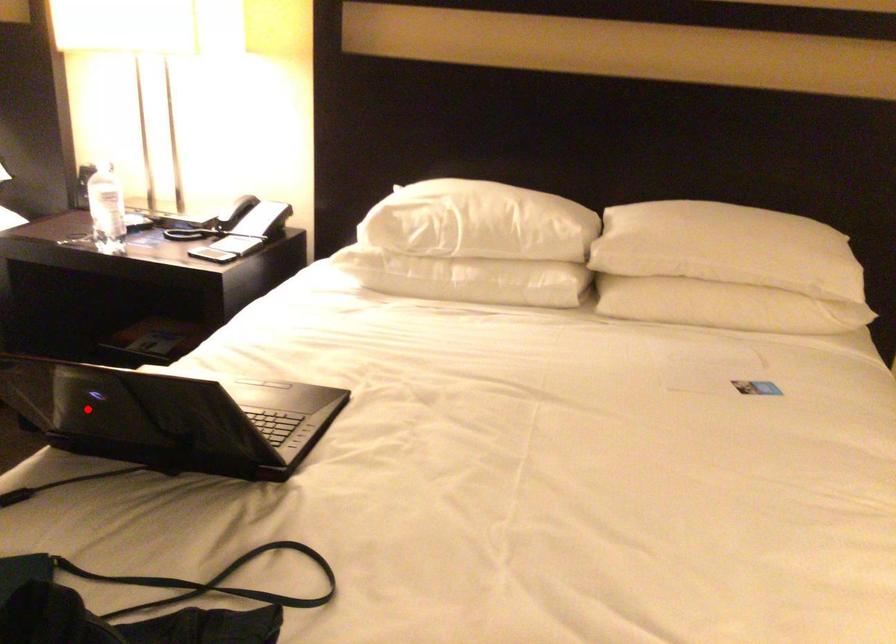
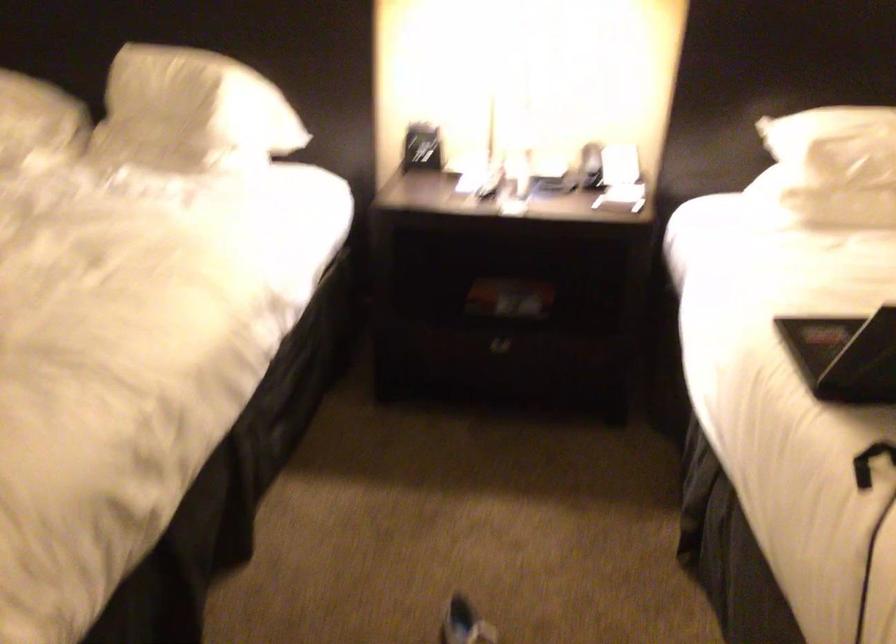
Where in the second image is the point corresponding to the highlighted location from the first image?

(845, 355)